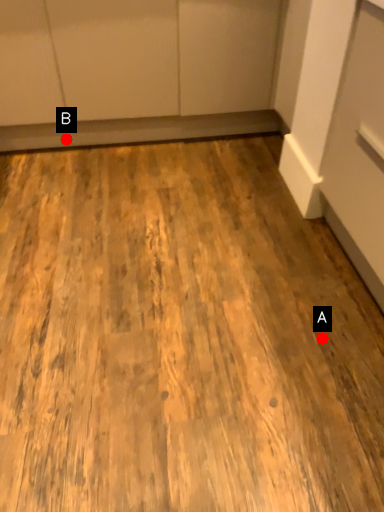
Question: Two points are circled on the image, labeled by A and B beside each circle. Which point is closer to the camera taking this photo?

Choices:
 (A) A is closer
 (B) B is closer

Answer: (A)